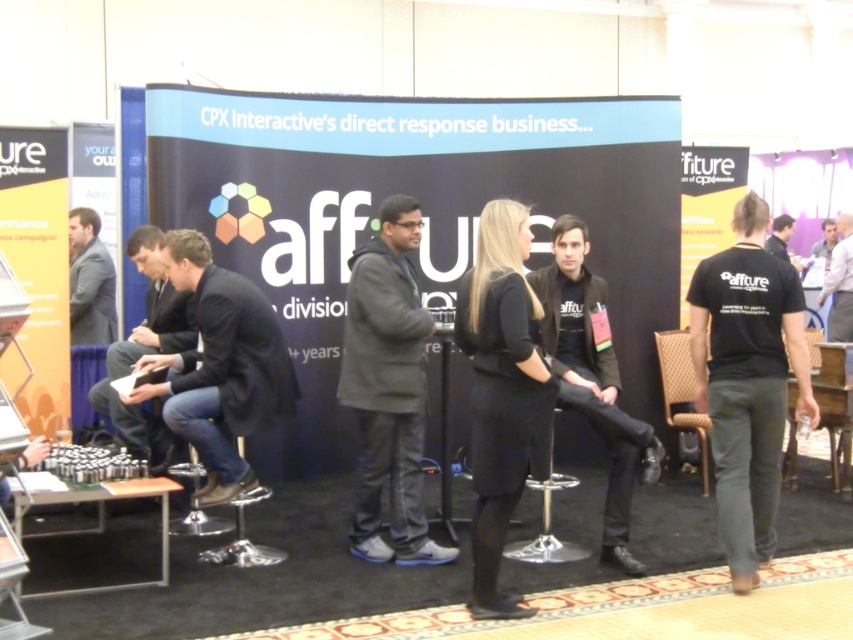
Please provide the 2D coordinates of the black fabric shirt at right in the image. The coordinates should be in the format of a point with two decimal places, such as point 0.5,0.5.

The 2D coordinates of the black fabric shirt at right are point [779,236].